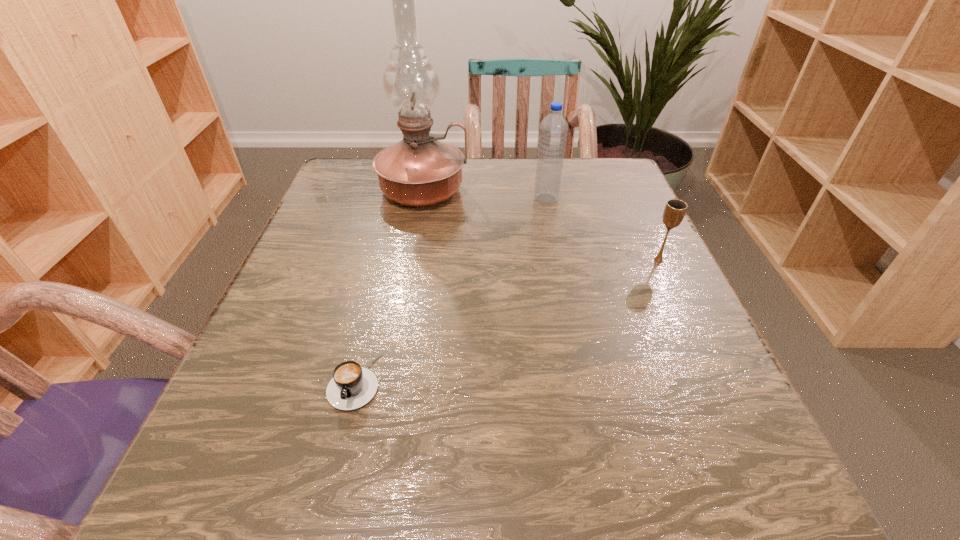
In order to click on vacant space in between the water bottle and the third farthest object in this screenshot , I will do `click(602, 230)`.

Locate an element on the screen. vacant region between the tallest object and the water bottle is located at coordinates (485, 194).

Locate an element on the screen. The width and height of the screenshot is (960, 540). free spot between the rightmost object and the second tallest object is located at coordinates (602, 230).

You are a GUI agent. You are given a task and a screenshot of the screen. Output one action in this format:
    pyautogui.click(x=<x>, y=<y>)
    Task: Click on the vacant space in between the third object from left to right and the nearest object
    This screenshot has width=960, height=540.
    Given the screenshot: What is the action you would take?
    pyautogui.click(x=450, y=290)

Locate an element on the screen. This screenshot has width=960, height=540. vacant area between the oil lamp and the shortest object is located at coordinates (389, 286).

At what (x,y) coordinates should I click in order to perform the action: click on object that is the third closest to the shortest object. Please return your answer as a coordinate pair (x, y). This screenshot has width=960, height=540. Looking at the image, I should click on (675, 209).

The height and width of the screenshot is (540, 960). What are the coordinates of `object that ranks as the third closest to the second shortest object` in the screenshot? It's located at (352, 386).

Where is `vacant region that satisfies the following two spatial constraints: 1. on the front side of the oil lamp; 2. on the left side of the third tallest object`? The image size is (960, 540). vacant region that satisfies the following two spatial constraints: 1. on the front side of the oil lamp; 2. on the left side of the third tallest object is located at coordinates (410, 260).

Locate an element on the screen. The image size is (960, 540). free spot that satisfies the following two spatial constraints: 1. on the front side of the rightmost object; 2. on the left side of the oil lamp is located at coordinates (410, 260).